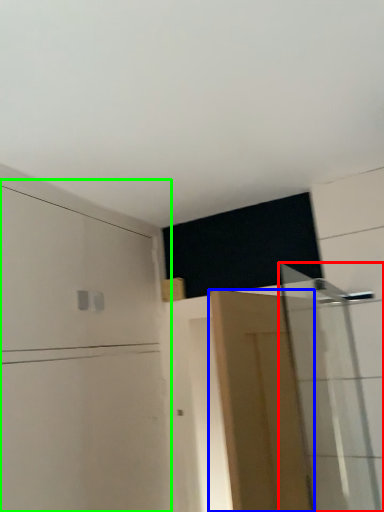
Question: Which object is the farthest from shower door (highlighted by a red box)? Choose among these: door (highlighted by a blue box) or dresser (highlighted by a green box).

Choices:
 (A) door
 (B) dresser

Answer: (B)